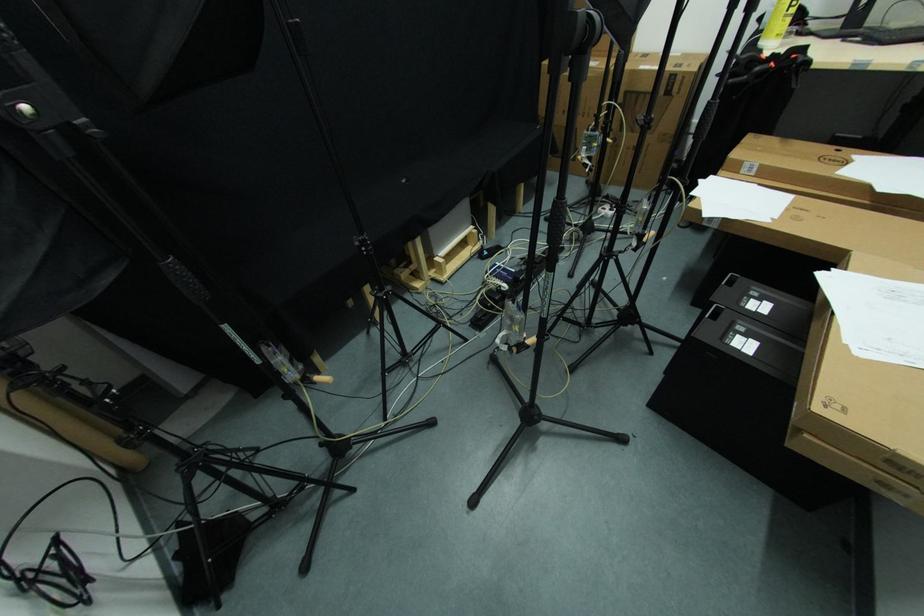
The location [725,398] corresponds to which object?

It refers to a black electronic device.